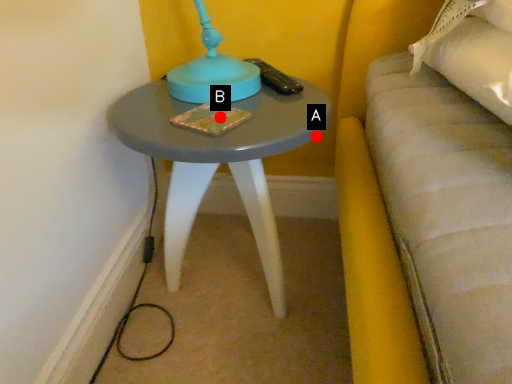
Question: Two points are circled on the image, labeled by A and B beside each circle. Which point is closer to the camera?

Choices:
 (A) A is closer
 (B) B is closer

Answer: (B)